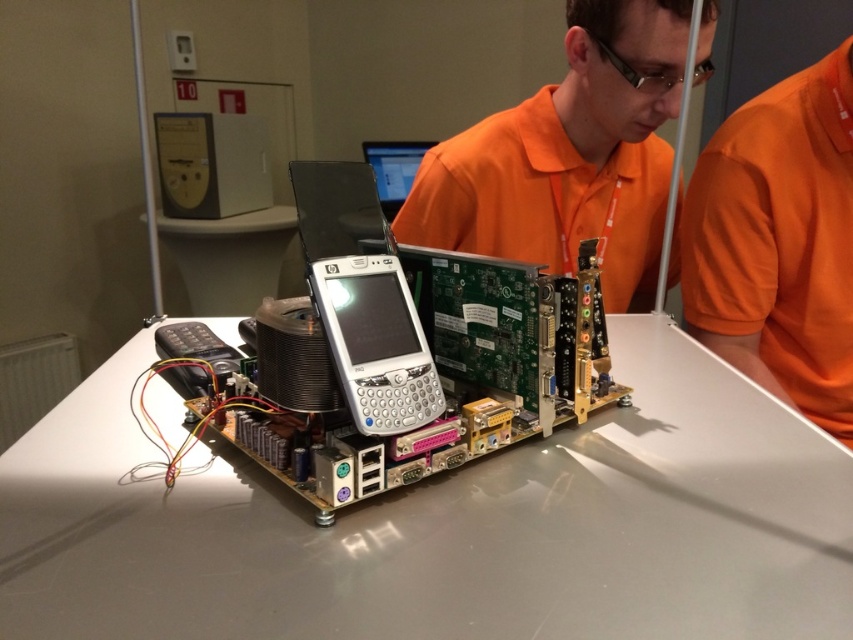
You are a delivery person who needs to place a package on the white glossy table at center. The package is 40 centimeters in length. Can you safely place it on the table without it overlapping with the orange fabric shirt at upper center?

The white glossy table at center is 42.81 centimeters away from the orange fabric shirt at upper center. Since the package is 40 centimeters long, it can be placed on the table without overlapping as the distance between them allows sufficient space.